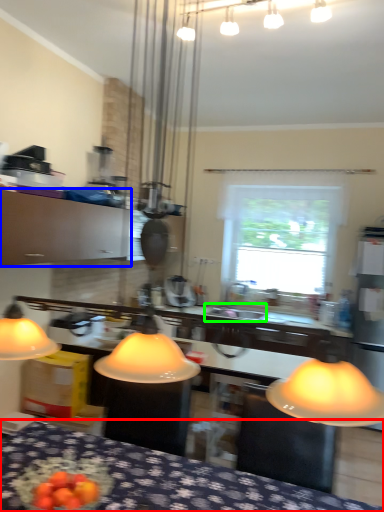
Question: Considering the real-world distances, which object is closest to furniture (highlighted by a red box)? cabinetry (highlighted by a blue box) or sink (highlighted by a green box).

Choices:
 (A) cabinetry
 (B) sink

Answer: (B)